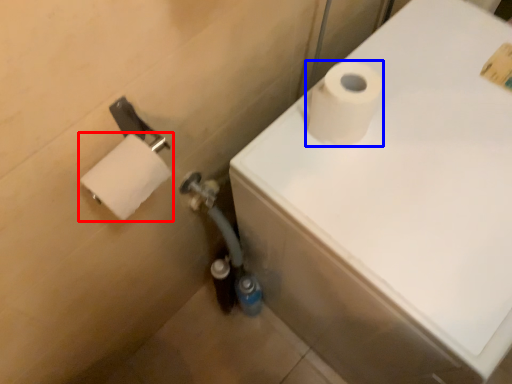
Question: Among these objects, which one is farthest to the camera, toilet paper (highlighted by a red box) or toilet paper (highlighted by a blue box)?

Choices:
 (A) toilet paper
 (B) toilet paper

Answer: (B)